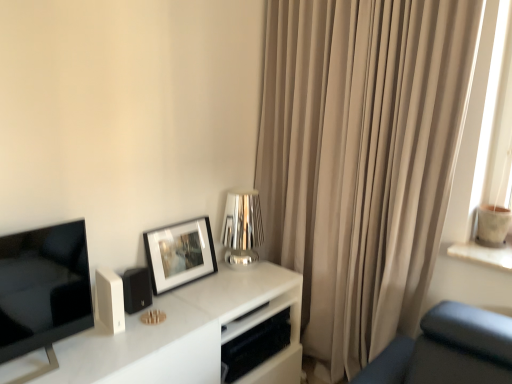
Locate an element on the screen. This screenshot has height=384, width=512. free space to the left of white plastic speaker at lower left is located at coordinates (80, 337).